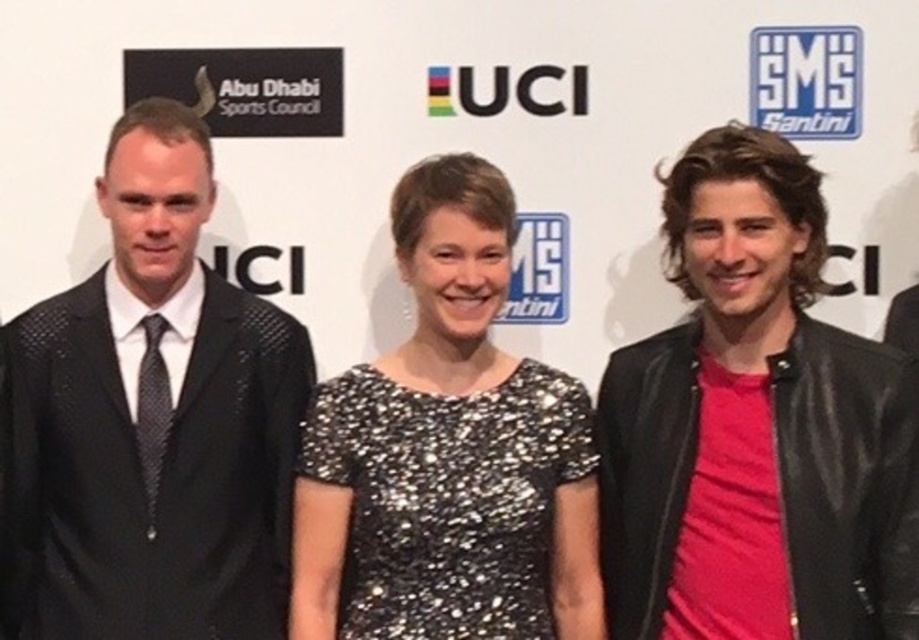
You are a photographer at a formal event. You need to arrange the two individuals wearing the black textured suit at left and the sparkly black dress at center so that their heights are proportional to the backdrop. Given that the backdrop has a height of 2 meters, which individual should stand closer to the backdrop to create the illusion of equal height?

The black textured suit at left is taller than the sparkly black dress at center. To create the illusion of equal height, the taller individual wearing the black textured suit at left should stand farther away from the backdrop, while the shorter sparkly black dress at center should be closer. This uses perspective to make them appear similar in height despite their actual difference.

You are standing in front of a backdrop with logos for Abu Dhabi Sports Council, UCI, and SMS Santini. There is a point at coordinates (777, 515). If you want to place a 1.5 meter wide banner horizontally at that point, will there be enough space?

The distance between the point (777, 515) and the viewer is 2.06 meters. Since the banner is 1.5 meters wide, there is sufficient space to place it horizontally at that point as the distance is greater than the banner width.